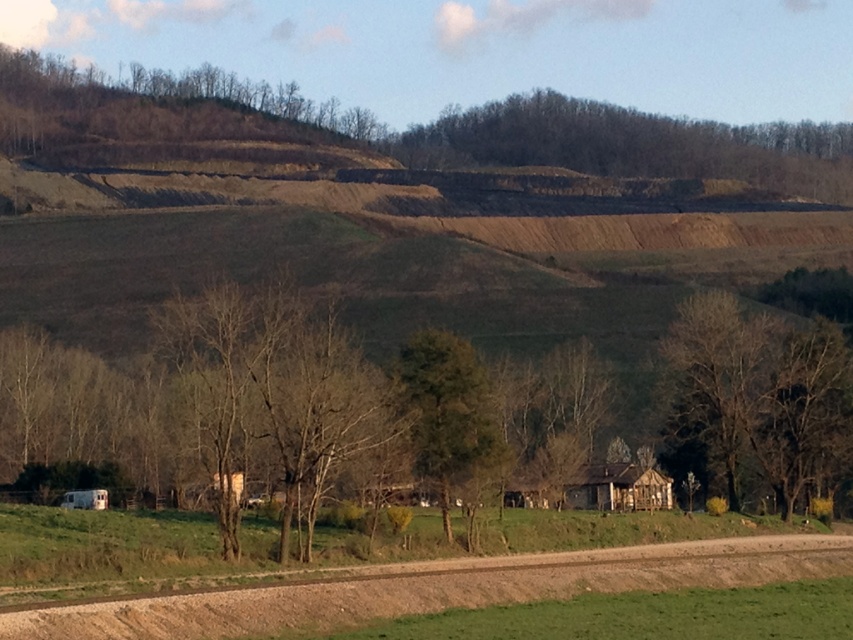
You are an environmental planner assessing the area. You need to determine which object, the brown textured hillside at upper center or the green leafy tree at center, is taller. Based on the scene, which one is taller?

The brown textured hillside at upper center is taller than the green leafy tree at center according to the description.

You are a hiker planning to take a photo of the weathered wood hut at center from the brown textured hillside at upper center. Can you position yourself on the hillside so that the hut is fully visible in your camera frame?

Yes, since the brown textured hillside at upper center is to the right of the weathered wood hut at center, positioning yourself on the hillside would allow you to have a clear view of the hut in your camera frame.

You are standing on the dirt road and looking towards the brown textured hillside at upper center and the brown textured tree at center. Which object is higher up in the image?

The brown textured hillside at upper center is positioned over the brown textured tree at center, so it is higher up in the image.